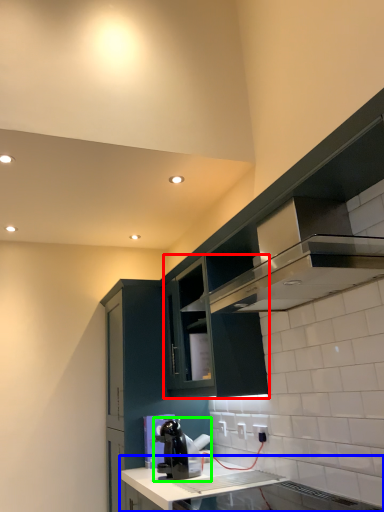
Question: Which object is positioned farthest from cabinetry (highlighted by a red box)? Select from countertop (highlighted by a blue box) and home appliance (highlighted by a green box).

Choices:
 (A) countertop
 (B) home appliance

Answer: (A)